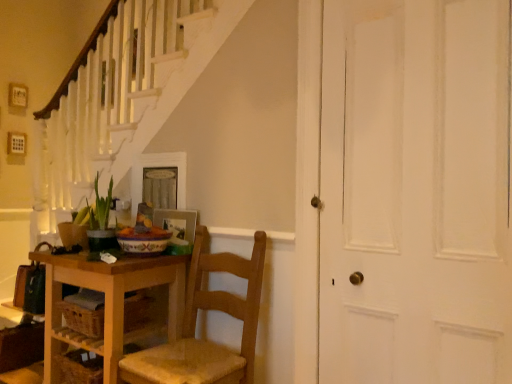
Question: Can you confirm if wooden picture frame at center, the 1th picture frame in the bottom-to-top sequence, is taller than wooden drawer at lower left?

Choices:
 (A) yes
 (B) no

Answer: (A)

Question: Can you confirm if wooden picture frame at center, the second picture frame positioned from the top, is shorter than wooden drawer at lower left?

Choices:
 (A) no
 (B) yes

Answer: (A)

Question: Is wooden picture frame at center, the second picture frame positioned from the top, next to wooden drawer at lower left?

Choices:
 (A) yes
 (B) no

Answer: (B)

Question: From the image's perspective, would you say wooden picture frame at center, the second picture frame positioned from the top, is positioned over wooden drawer at lower left?

Choices:
 (A) no
 (B) yes

Answer: (B)

Question: Considering the relative sizes of wooden picture frame at center, the second picture frame positioned from the top, and wooden drawer at lower left in the image provided, is wooden picture frame at center, the second picture frame positioned from the top, bigger than wooden drawer at lower left?

Choices:
 (A) yes
 (B) no

Answer: (B)

Question: Considering the positions of white matte door at right and wooden table at lower left in the image, is white matte door at right bigger or smaller than wooden table at lower left?

Choices:
 (A) big
 (B) small

Answer: (B)

Question: Considering their positions, is white matte door at right located in front of or behind wooden table at lower left?

Choices:
 (A) behind
 (B) front

Answer: (B)

Question: From a real-world perspective, is white matte door at right physically located above or below wooden table at lower left?

Choices:
 (A) below
 (B) above

Answer: (B)

Question: Considering the positions of white matte door at right and wooden table at lower left in the image, is white matte door at right taller or shorter than wooden table at lower left?

Choices:
 (A) short
 (B) tall

Answer: (B)

Question: From the image's perspective, is green leafy plant at lower left located above or below wooden chair at center?

Choices:
 (A) below
 (B) above

Answer: (B)

Question: Is point (97, 195) closer or farther from the camera than point (197, 269)?

Choices:
 (A) closer
 (B) farther

Answer: (B)

Question: Looking at their shapes, would you say green leafy plant at lower left is wider or thinner than wooden chair at center?

Choices:
 (A) wide
 (B) thin

Answer: (B)

Question: Considering the relative positions of green leafy plant at lower left and wooden chair at center in the image provided, is green leafy plant at lower left to the left or to the right of wooden chair at center?

Choices:
 (A) right
 (B) left

Answer: (B)

Question: Considering the positions of wooden picture frame at center, the 1th picture frame in the bottom-to-top sequence, and wooden table at lower left in the image, is wooden picture frame at center, the 1th picture frame in the bottom-to-top sequence, taller or shorter than wooden table at lower left?

Choices:
 (A) short
 (B) tall

Answer: (A)

Question: From a real-world perspective, is wooden picture frame at center, the 1th picture frame in the bottom-to-top sequence, above or below wooden table at lower left?

Choices:
 (A) above
 (B) below

Answer: (A)